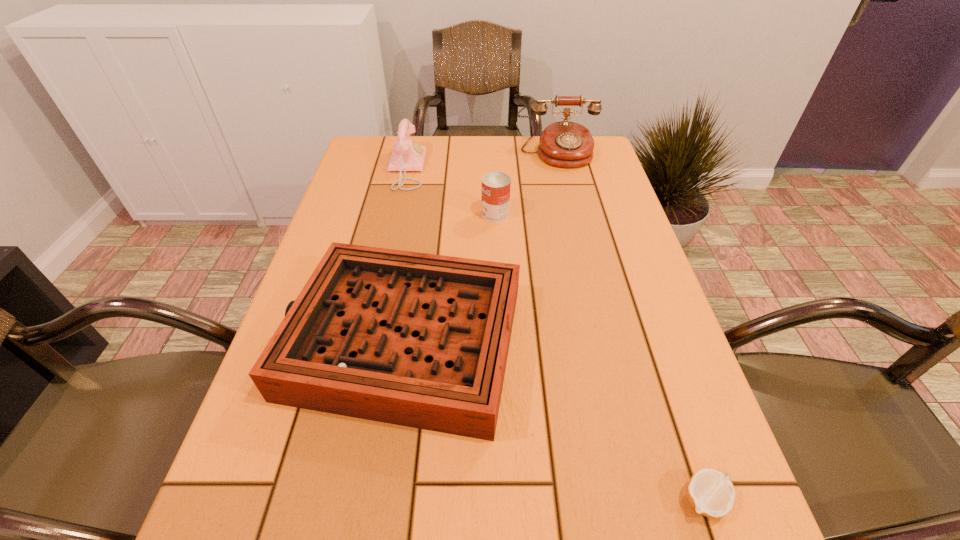
You are a GUI agent. You are given a task and a screenshot of the screen. Output one action in this format:
    pyautogui.click(x=<x>, y=<y>)
    Task: Click on the free space between the lemon and the gameboard
    The width and height of the screenshot is (960, 540).
    Given the screenshot: What is the action you would take?
    pyautogui.click(x=556, y=419)

This screenshot has width=960, height=540. In order to click on vacant area that lies between the fourth farthest object and the right telephone in this screenshot , I will do `click(482, 246)`.

What are the coordinates of `the third closest object to the shorter telephone` in the screenshot? It's located at (414, 339).

Select which object is the closest to the lemon. Please provide its 2D coordinates. Your answer should be formatted as a tuple, i.e. [(x, y)], where the tuple contains the x and y coordinates of a point satisfying the conditions above.

[(414, 339)]

At what (x,y) coordinates should I click in order to perform the action: click on free space that satisfies the following two spatial constraints: 1. on the front label of the shortest object; 2. on the right side of the can. Please return your answer as a coordinate pair (x, y). Looking at the image, I should click on (507, 500).

This screenshot has width=960, height=540. Identify the location of vacant position in the image that satisfies the following two spatial constraints: 1. on the dial of the nearest object; 2. on the right side of the left telephone. (333, 500).

At what (x,y) coordinates should I click in order to perform the action: click on free spot that satisfies the following two spatial constraints: 1. on the front label of the third farthest object; 2. on the right side of the nearest object. Please return your answer as a coordinate pair (x, y). This screenshot has width=960, height=540. Looking at the image, I should click on (507, 500).

Where is `blank area in the image that satisfies the following two spatial constraints: 1. on the dial of the left telephone; 2. on the back side of the second nearest object`? blank area in the image that satisfies the following two spatial constraints: 1. on the dial of the left telephone; 2. on the back side of the second nearest object is located at coordinates (370, 338).

In order to click on free space that satisfies the following two spatial constraints: 1. on the dial of the nearest object; 2. on the left side of the left telephone in this screenshot , I will do click(333, 500).

I want to click on free space that satisfies the following two spatial constraints: 1. on the dial of the taller telephone; 2. on the right side of the lemon, so pyautogui.click(x=641, y=500).